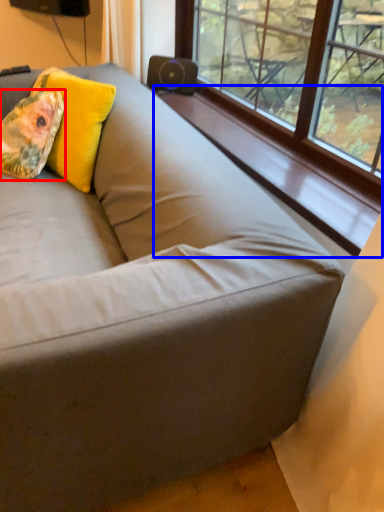
Question: Which of the following is the closest to the observer, throw pillow (highlighted by a red box) or window sill (highlighted by a blue box)?

Choices:
 (A) throw pillow
 (B) window sill

Answer: (B)